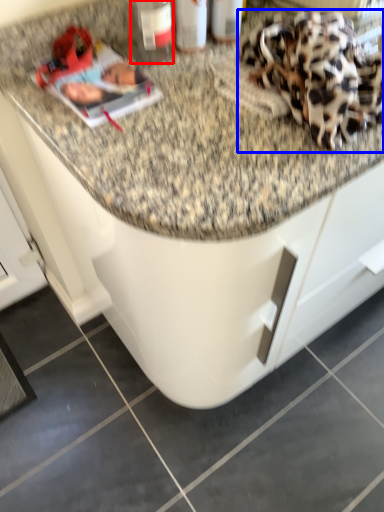
Question: Which object is closer to the camera taking this photo, bottle (highlighted by a red box) or stuff (highlighted by a blue box)?

Choices:
 (A) bottle
 (B) stuff

Answer: (B)